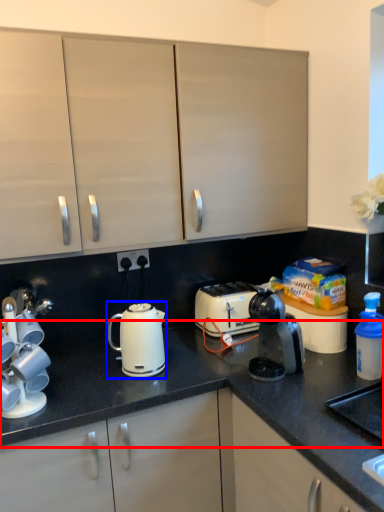
Question: Which object appears closest to the camera in this image, countertop (highlighted by a red box) or kettle (highlighted by a blue box)?

Choices:
 (A) countertop
 (B) kettle

Answer: (A)